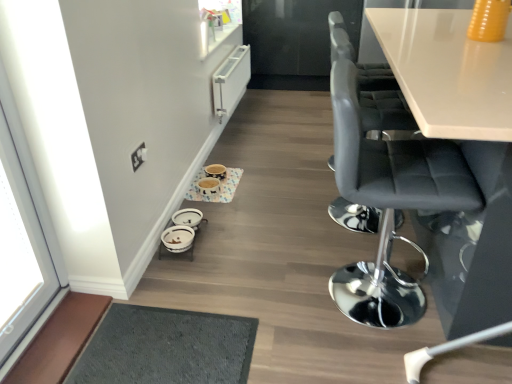
Locate an element on the screen. The height and width of the screenshot is (384, 512). free space between white glass window at left and gray fabric chair at right, the 2th chair viewed from the front is located at coordinates (222, 268).